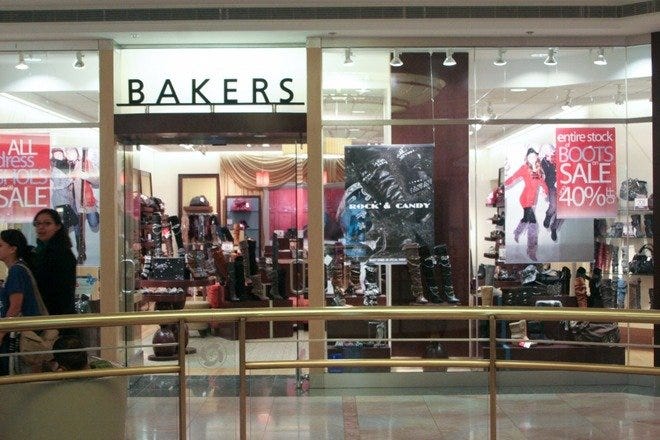
Identify the location of frame. (99, 229).